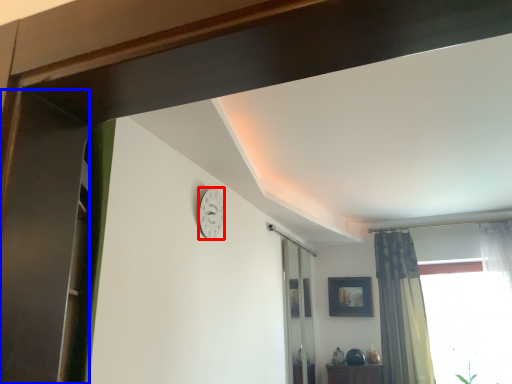
Question: Among these objects, which one is farthest to the camera, clock (highlighted by a red box) or screen door (highlighted by a blue box)?

Choices:
 (A) clock
 (B) screen door

Answer: (A)